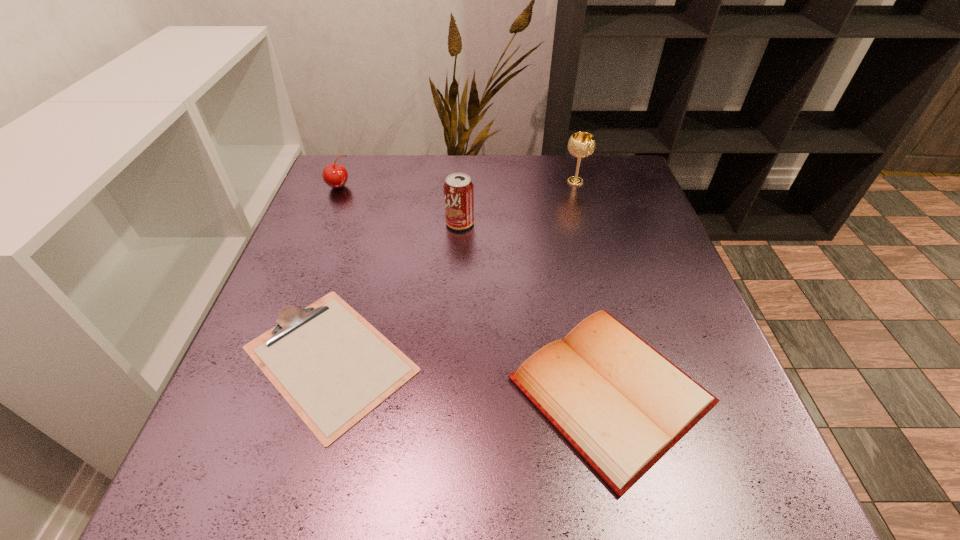
This screenshot has width=960, height=540. What are the coordinates of `empty space between the shortest object and the Bible` in the screenshot? It's located at (470, 375).

You are a GUI agent. You are given a task and a screenshot of the screen. Output one action in this format:
    pyautogui.click(x=<x>, y=<y>)
    Task: Click on the vacant area between the shortest object and the Bible
    This screenshot has width=960, height=540.
    Given the screenshot: What is the action you would take?
    pyautogui.click(x=470, y=375)

Locate an element on the screen. free spot between the third tallest object and the third object from right to left is located at coordinates 399,205.

Find the location of `empty space that is in between the clipboard and the Bible`. empty space that is in between the clipboard and the Bible is located at coordinates click(470, 375).

Find the location of a particular element. This screenshot has height=540, width=960. vacant space that is in between the cherry and the second shortest object is located at coordinates 474,288.

The height and width of the screenshot is (540, 960). I want to click on unoccupied position between the chalice and the second shortest object, so click(593, 286).

Locate an element on the screen. This screenshot has width=960, height=540. vacant space that's between the fourth tallest object and the cherry is located at coordinates (474, 288).

Locate which object is the second closest to the third object from right to left. Please provide its 2D coordinates. Your answer should be formatted as a tuple, i.e. [(x, y)], where the tuple contains the x and y coordinates of a point satisfying the conditions above.

[(622, 405)]

At what (x,y) coordinates should I click in order to perform the action: click on the closest object to the clipboard. Please return your answer as a coordinate pair (x, y). The height and width of the screenshot is (540, 960). Looking at the image, I should click on (622, 405).

The height and width of the screenshot is (540, 960). Identify the location of free space that satisfies the following two spatial constraints: 1. on the back side of the third shortest object; 2. on the right side of the chalice. (341, 181).